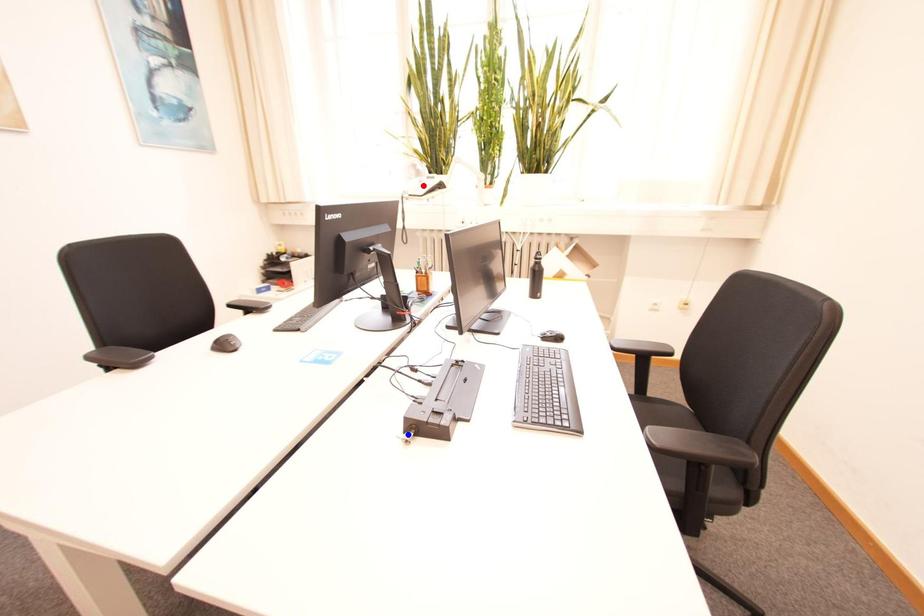
Question: Two points are marked on the image. Which point is closer to the camera?

Choices:
 (A) Blue point is closer.
 (B) Red point is closer.

Answer: (A)